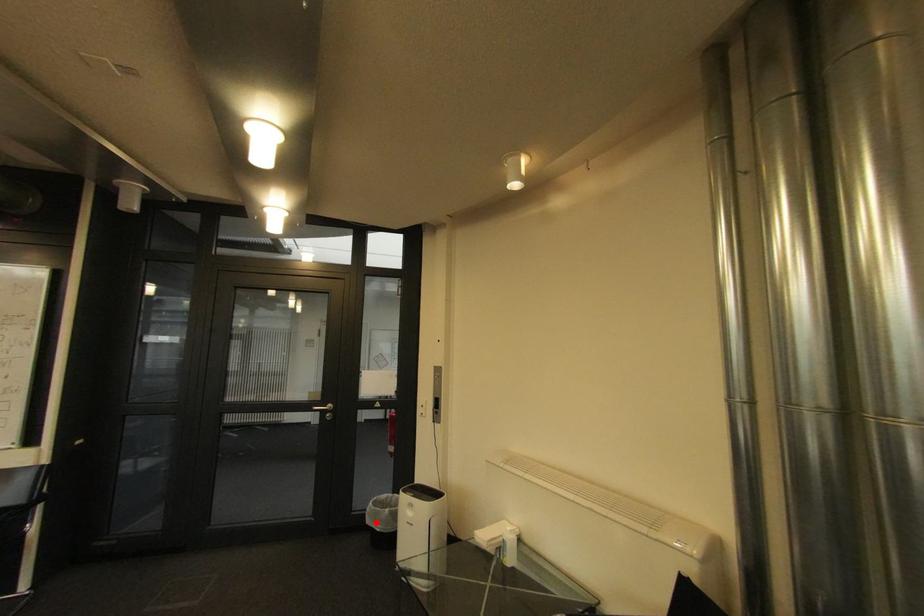
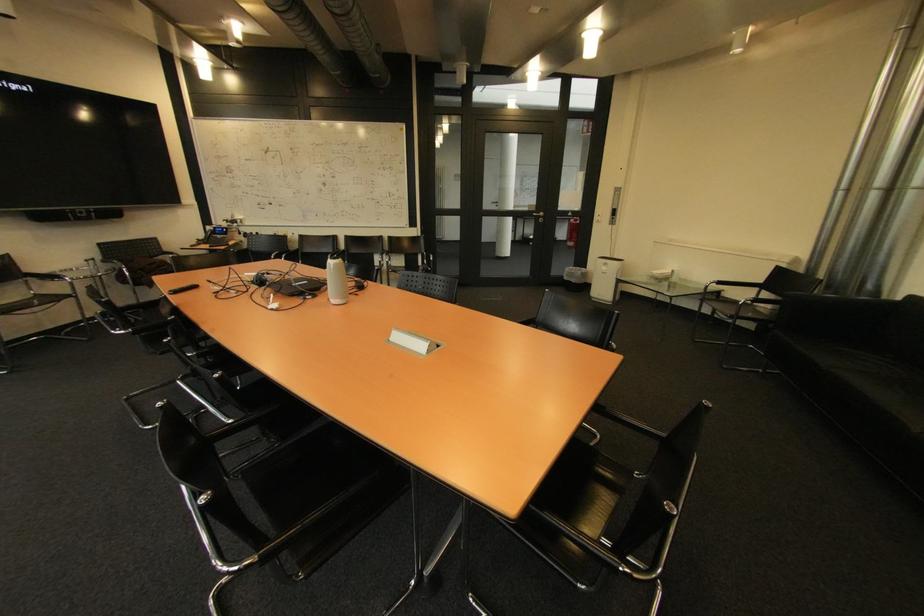
Where in the second image is the point corresponding to the highlighted location from the first image?

(574, 280)